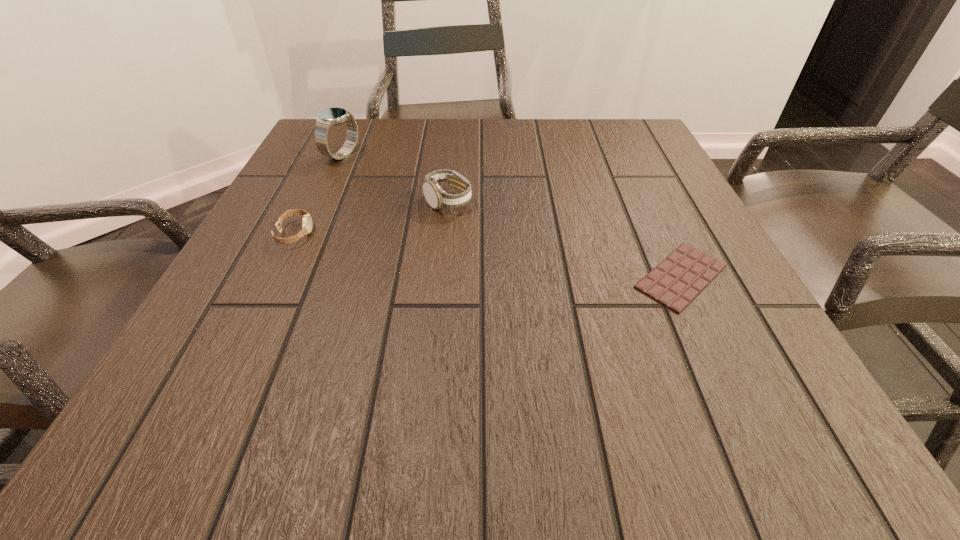
Locate an element on the screen. free space at the near left corner is located at coordinates (259, 410).

Where is `vacant space at the far right corner of the desktop`? vacant space at the far right corner of the desktop is located at coordinates (591, 127).

In the image, there is a desktop. Where is `free region at the near right corner`? free region at the near right corner is located at coordinates (703, 447).

Image resolution: width=960 pixels, height=540 pixels. In order to click on vacant point located between the farthest watch and the rightmost watch in this screenshot , I will do `click(395, 178)`.

Locate an element on the screen. free space that is in between the shortest watch and the second shortest watch is located at coordinates (372, 217).

The width and height of the screenshot is (960, 540). In order to click on empty space that is in between the farthest object and the rightmost object in this screenshot , I will do `click(512, 215)`.

Where is `free spot between the third tallest object and the second shortest watch`? free spot between the third tallest object and the second shortest watch is located at coordinates (372, 217).

Find the location of a particular element. vacant region between the shortest watch and the second tallest watch is located at coordinates (372, 217).

Where is `vacant region between the farthest watch and the second tallest watch`? The height and width of the screenshot is (540, 960). vacant region between the farthest watch and the second tallest watch is located at coordinates (395, 178).

This screenshot has height=540, width=960. Find the location of `free space between the rightmost object and the nearest watch`. free space between the rightmost object and the nearest watch is located at coordinates (488, 255).